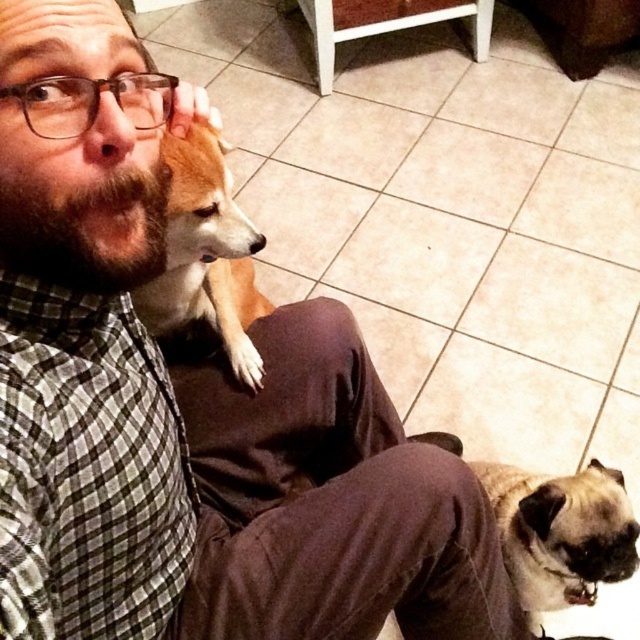
Question: Is light brown fur at upper left closer to the viewer compared to fuzzy beige dog at lower right?

Choices:
 (A) no
 (B) yes

Answer: (B)

Question: Is light brown fur at upper left closer to the viewer compared to fuzzy beige dog at lower right?

Choices:
 (A) yes
 (B) no

Answer: (A)

Question: Is the position of light brown fur at upper left more distant than that of fuzzy beige dog at lower right?

Choices:
 (A) no
 (B) yes

Answer: (A)

Question: Among these objects, which one is nearest to the camera?

Choices:
 (A) fuzzy beige dog at lower right
 (B) light brown fur at upper left

Answer: (B)